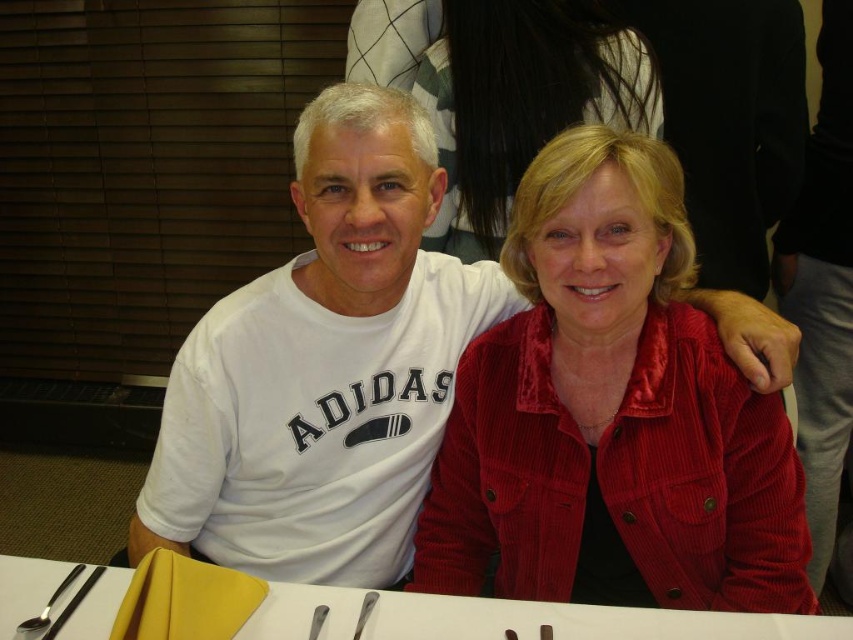
You are a photographer adjusting your camera settings. You need to focus on the tallest object between the satin red jacket at center and the polished silver spoon at lower left. Which object should you focus on?

The satin red jacket at center is taller than the polished silver spoon at lower left, so you should focus on the satin red jacket at center.

Based on the coordinates provided, is the point at (611, 410) located on the satin red jacket at center?

Yes, the point at (611, 410) is located on the satin red jacket at center as stated in the Objects Description.